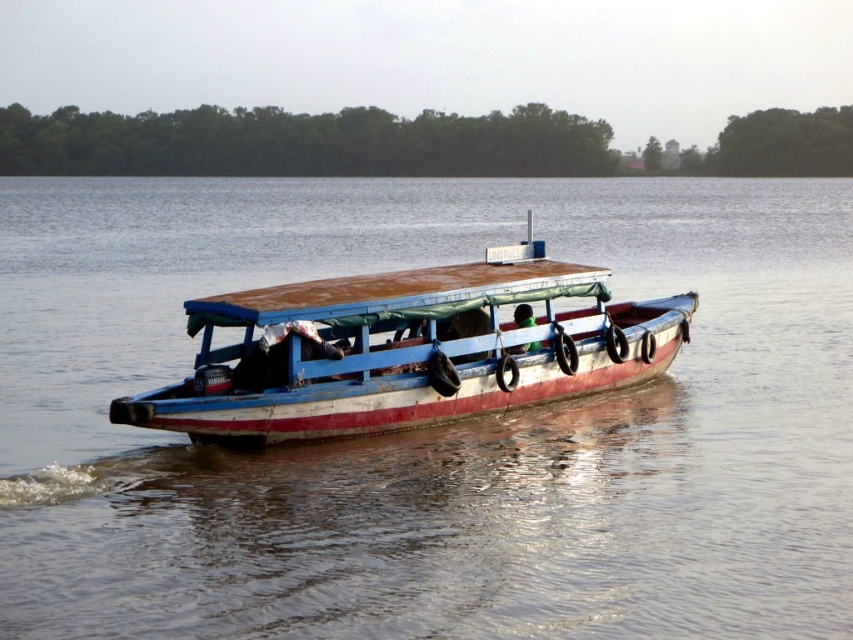
Between brown wooden boat at center and rusty metal boat at center, which one appears on the left side from the viewer's perspective?

From the viewer's perspective, rusty metal boat at center appears more on the left side.

I want to click on brown wooden boat at center, so pos(428,428).